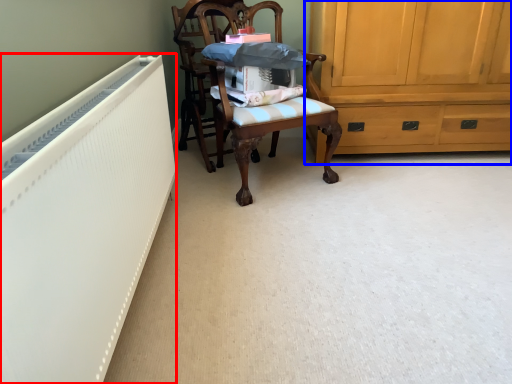
Question: Which object appears closest to the camera in this image, radiator (highlighted by a red box) or cabinetry (highlighted by a blue box)?

Choices:
 (A) radiator
 (B) cabinetry

Answer: (A)